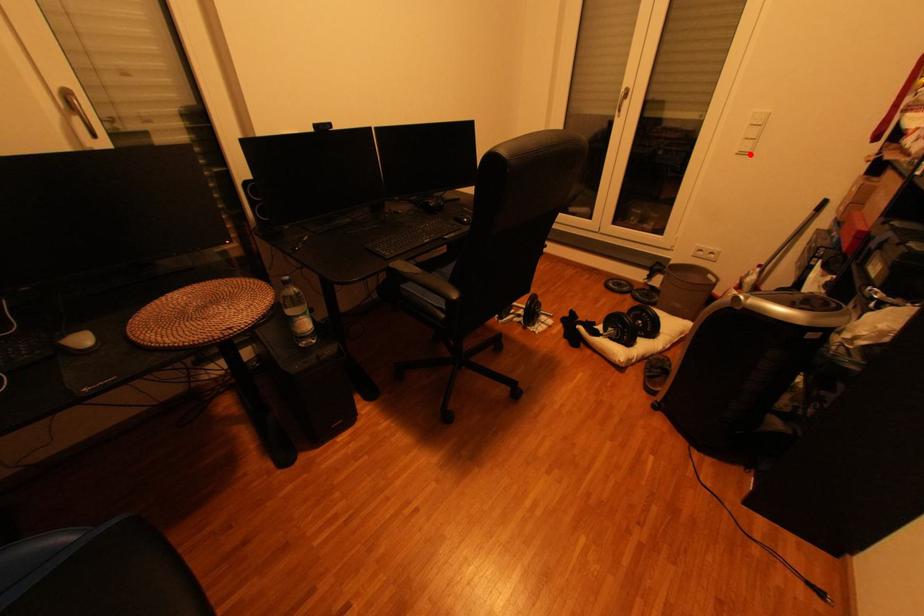
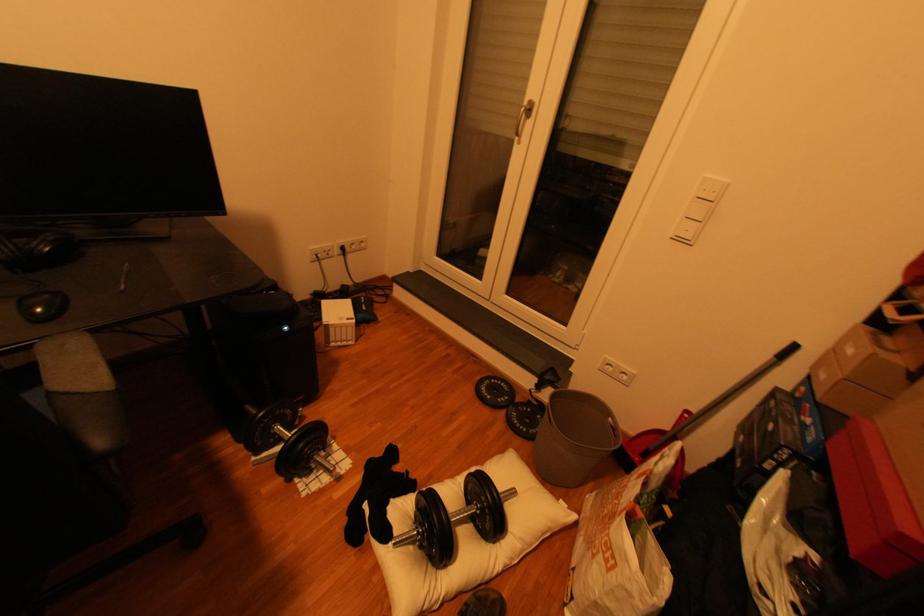
In the second image, find the point that corresponds to the highlighted location in the first image.

(687, 240)